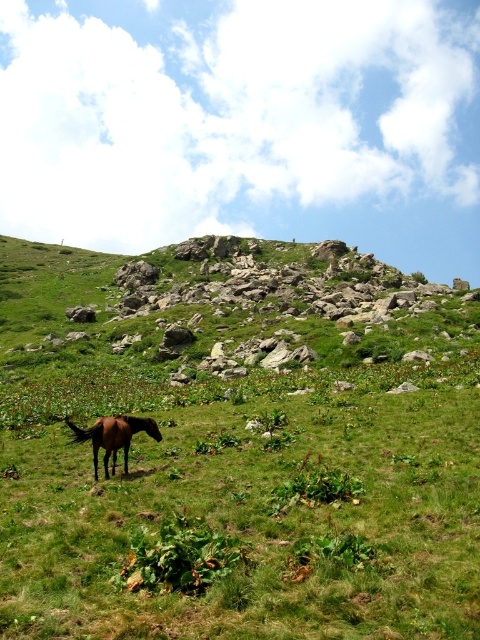
Question: Which object appears farthest from the camera in this image?

Choices:
 (A) brown glossy horse at lower left
 (B) green grassy hillside at center

Answer: (B)

Question: Does green grassy hillside at center appear on the left side of brown glossy horse at lower left?

Choices:
 (A) no
 (B) yes

Answer: (B)

Question: Which point is farther from the camera taking this photo?

Choices:
 (A) (96, 470)
 (B) (11, 276)

Answer: (B)

Question: Does green grassy hillside at center have a smaller size compared to brown glossy horse at lower left?

Choices:
 (A) no
 (B) yes

Answer: (A)

Question: Does green grassy hillside at center appear on the left side of brown glossy horse at lower left?

Choices:
 (A) no
 (B) yes

Answer: (B)